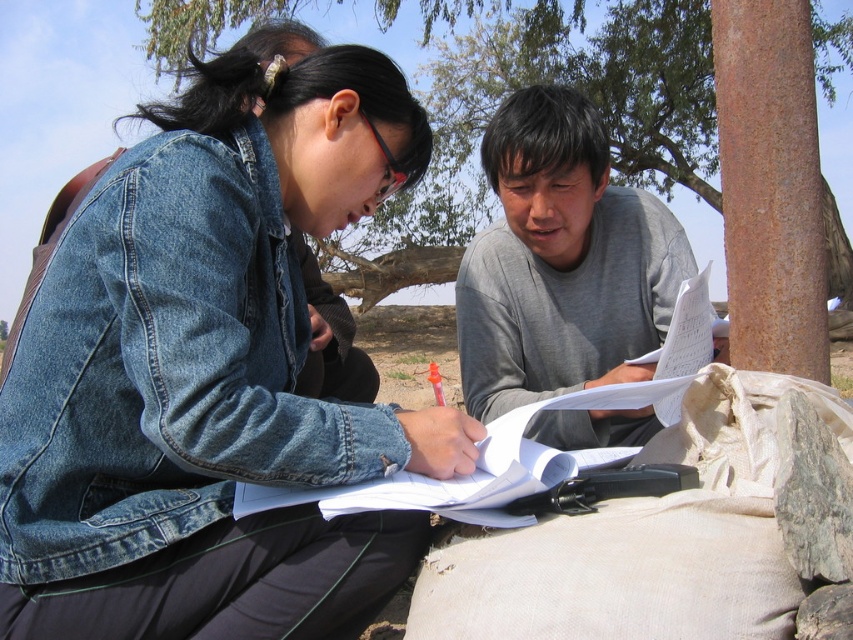
You are standing at the point with coordinates point (840, 282) and want to walk to the point with coordinates point (595, 428). Which direction should you move in to reach your destination?

You should move forward because point (595, 428) is in front of point (840, 282).

You are planning to place a 20 feet long bench between the denim jacket at upper left and the brown rough tree at upper center. Will the bench fit without overlapping either object?

The denim jacket at upper left and brown rough tree at upper center are 23.75 feet apart from each other. Since the bench is 20 feet long, it will fit between them without overlapping either object as there is sufficient space.

You are a photographer trying to capture a candid shot of both the denim jacket at upper left and the gray cotton shirt at center. Since you want to ensure both are in focus, you need to know their relative positions. Which one is closer to the camera?

The denim jacket at upper left is in front of the gray cotton shirt at center, so it is closer to the camera.